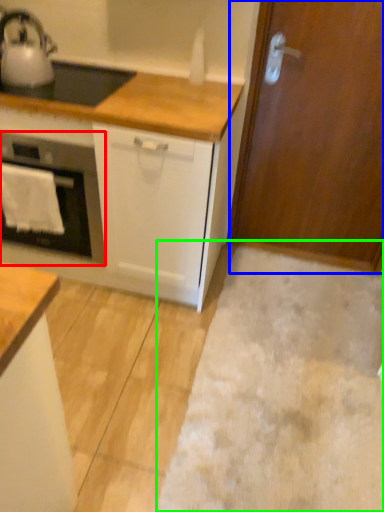
Question: Which is farther away from home appliance (highlighted by a red box)? door (highlighted by a blue box) or plain (highlighted by a green box)?

Choices:
 (A) door
 (B) plain

Answer: (A)